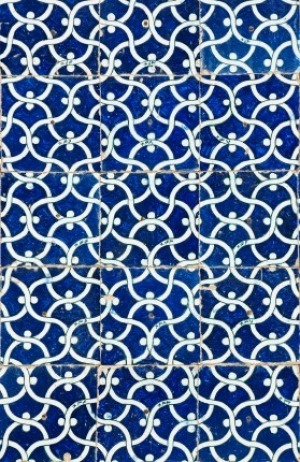
Locate an element on the screen. This screenshot has height=462, width=300. row 4 of tile is located at coordinates (143, 316).